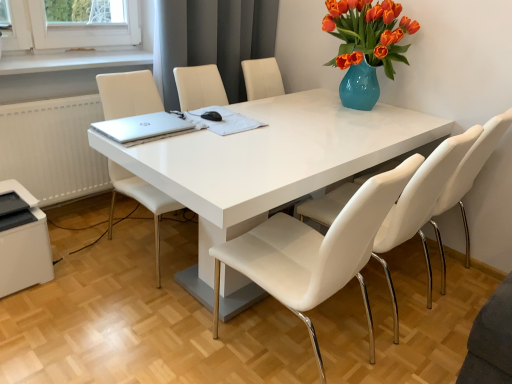
Question: Can you confirm if white glossy table at center is bigger than white leather chair at right, the 3th chair in the left-to-right sequence?

Choices:
 (A) yes
 (B) no

Answer: (A)

Question: Is white glossy table at center facing towards white leather chair at right, the 3th chair in the left-to-right sequence?

Choices:
 (A) yes
 (B) no

Answer: (B)

Question: Is white glossy table at center not within white leather chair at right, which is the first chair from right to left?

Choices:
 (A) yes
 (B) no

Answer: (A)

Question: From a real-world perspective, is white glossy table at center over white leather chair at right, the 3th chair in the left-to-right sequence?

Choices:
 (A) yes
 (B) no

Answer: (B)

Question: Is there a large distance between white glossy table at center and white leather chair at right, which is the first chair from right to left?

Choices:
 (A) yes
 (B) no

Answer: (B)

Question: Does white glossy table at center have a greater height compared to white leather chair at right, the 3th chair in the left-to-right sequence?

Choices:
 (A) yes
 (B) no

Answer: (B)

Question: From the image's perspective, would you say gray fabric curtain at upper center is shown under white leather chair at center, acting as the third chair starting from the right?

Choices:
 (A) yes
 (B) no

Answer: (B)

Question: Can you see gray fabric curtain at upper center touching white leather chair at center, which is the 1th chair in left-to-right order?

Choices:
 (A) no
 (B) yes

Answer: (A)

Question: Considering the relative sizes of gray fabric curtain at upper center and white leather chair at center, which is the 1th chair in left-to-right order, in the image provided, is gray fabric curtain at upper center shorter than white leather chair at center, which is the 1th chair in left-to-right order,?

Choices:
 (A) yes
 (B) no

Answer: (A)

Question: From a real-world perspective, is gray fabric curtain at upper center under white leather chair at center, acting as the third chair starting from the right?

Choices:
 (A) yes
 (B) no

Answer: (B)

Question: Does gray fabric curtain at upper center come behind white leather chair at center, which is the 1th chair in left-to-right order?

Choices:
 (A) yes
 (B) no

Answer: (A)

Question: Can you confirm if gray fabric curtain at upper center is bigger than white leather chair at center, which is the 1th chair in left-to-right order?

Choices:
 (A) yes
 (B) no

Answer: (B)

Question: Is white leather chair at center, which ranks as the second chair in left-to-right order, positioned in front of gray fabric curtain at upper center?

Choices:
 (A) yes
 (B) no

Answer: (A)